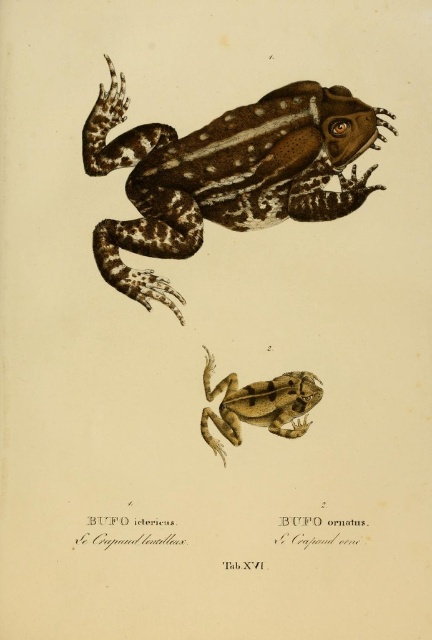
Who is positioned more to the left, brown spotted skin frog at upper center or brown textured frog at center?

From the viewer's perspective, brown spotted skin frog at upper center appears more on the left side.

Can you confirm if brown spotted skin frog at upper center is smaller than brown textured frog at center?

No.

Measure the distance between brown spotted skin frog at upper center and camera.

The distance of brown spotted skin frog at upper center from camera is 9.00 meters.

Find the location of `brown spotted skin frog at upper center`. brown spotted skin frog at upper center is located at coordinates (225, 173).